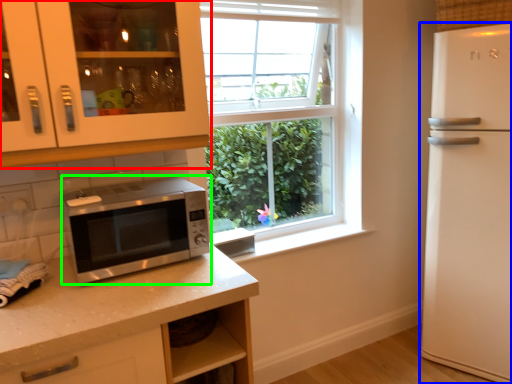
Question: Estimate the real-world distances between objects in this image. Which object is closer to cabinetry (highlighted by a red box), refrigerator (highlighted by a blue box) or microwave oven (highlighted by a green box)?

Choices:
 (A) refrigerator
 (B) microwave oven

Answer: (B)